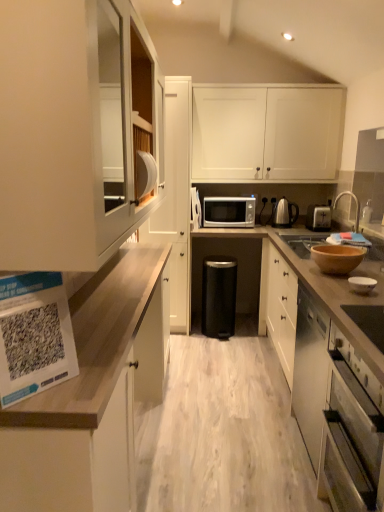
Find the location of a particular element. This screenshot has height=512, width=384. empty space that is ontop of wooden countertop at left, positioned as the 3th cabinetry in right-to-left order (from a real-world perspective) is located at coordinates (119, 280).